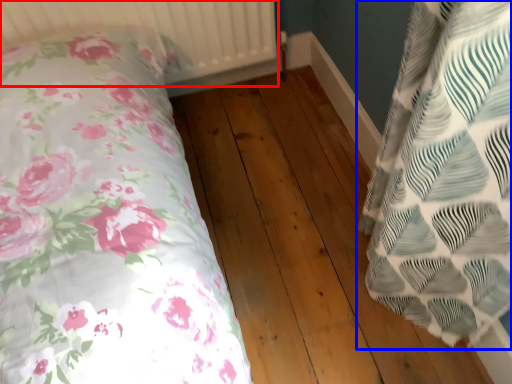
Question: Which object is closer to the camera taking this photo, radiator (highlighted by a red box) or pillow (highlighted by a blue box)?

Choices:
 (A) radiator
 (B) pillow

Answer: (B)